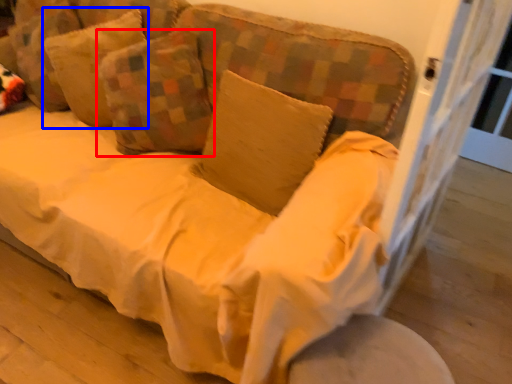
Question: Which object appears farthest to the camera in this image, pillow (highlighted by a red box) or pillow (highlighted by a blue box)?

Choices:
 (A) pillow
 (B) pillow

Answer: (B)